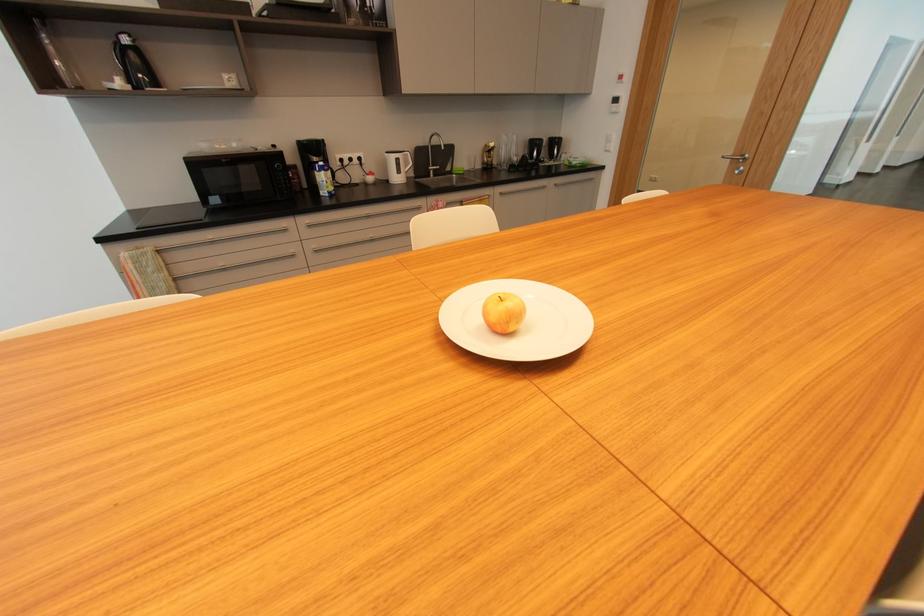
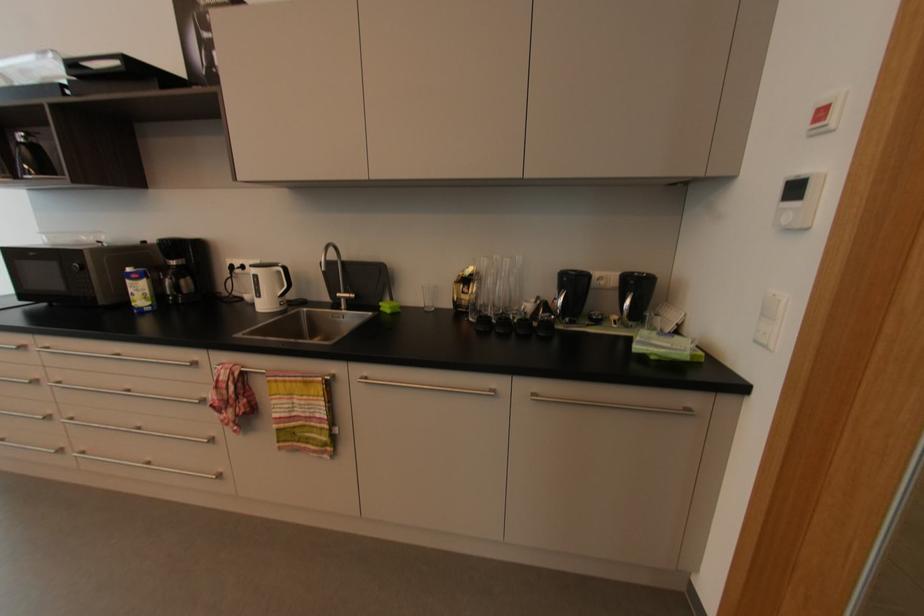
The point at (560, 185) is marked in the first image. Where is the corresponding point in the second image?

(537, 395)